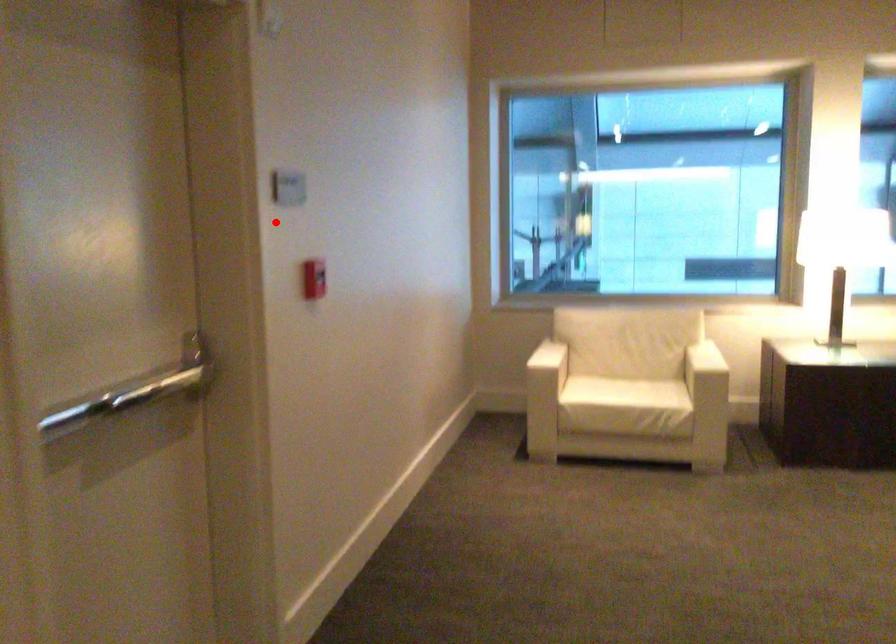
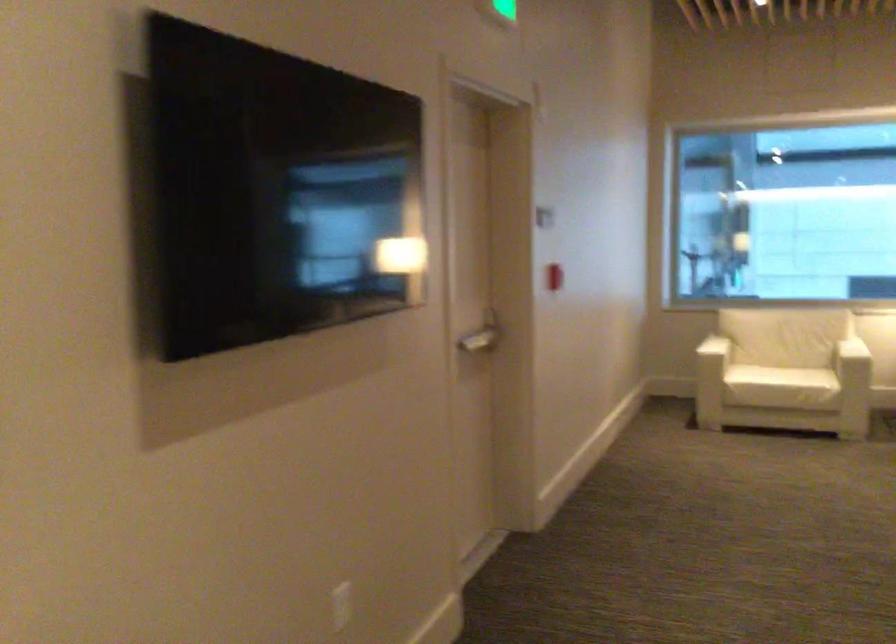
In the second image, find the point that corresponds to the highlighted location in the first image.

(544, 216)